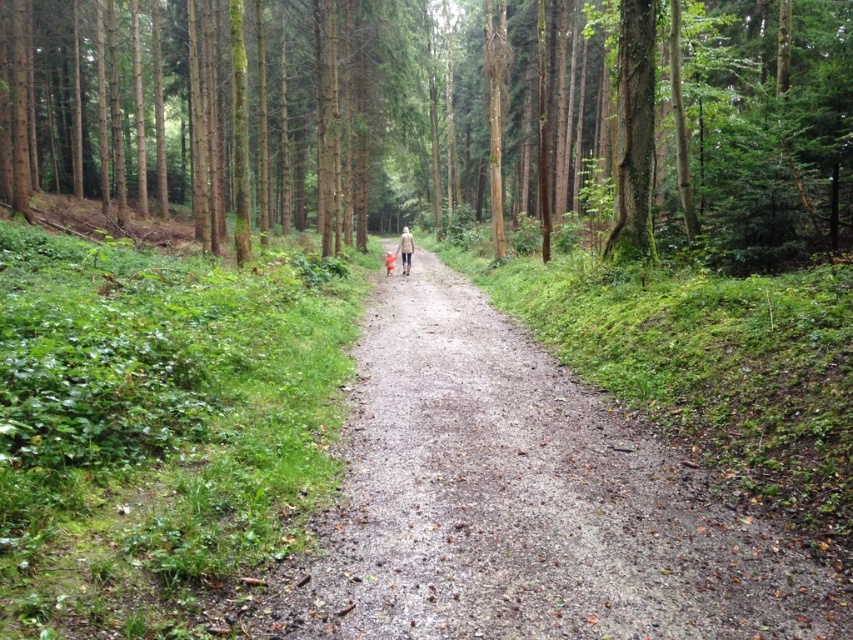
Question: Is dirt path at center bigger than light brown leather jacket at center?

Choices:
 (A) yes
 (B) no

Answer: (B)

Question: Which object appears farthest from the camera in this image?

Choices:
 (A) dirt path at center
 (B) light brown leather jacket at center
 (C) green mossy tree at center

Answer: (B)

Question: Does green mossy tree at center come behind dirt path at center?

Choices:
 (A) no
 (B) yes

Answer: (B)

Question: Can you confirm if light brown leather jacket at center is positioned to the left of orange fabric child at center?

Choices:
 (A) yes
 (B) no

Answer: (A)

Question: Which point is closer to the camera?

Choices:
 (A) (392, 266)
 (B) (712, 45)
 (C) (695, 614)

Answer: (C)

Question: Considering the real-world distances, which object is closest to the orange fabric child at center?

Choices:
 (A) dirt path at center
 (B) light brown leather jacket at center
 (C) green mossy tree at center

Answer: (B)